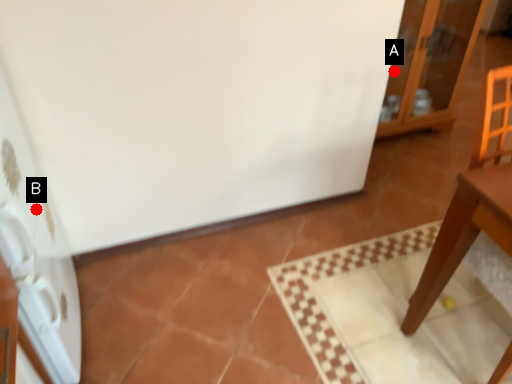
Question: Two points are circled on the image, labeled by A and B beside each circle. Which point is closer to the camera?

Choices:
 (A) A is closer
 (B) B is closer

Answer: (B)